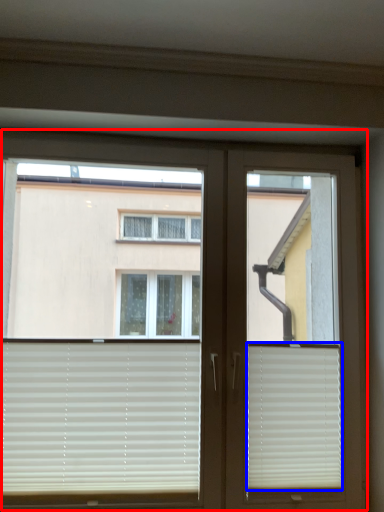
Question: Among these objects, which one is farthest to the camera, window (highlighted by a red box) or window blind (highlighted by a blue box)?

Choices:
 (A) window
 (B) window blind

Answer: (B)